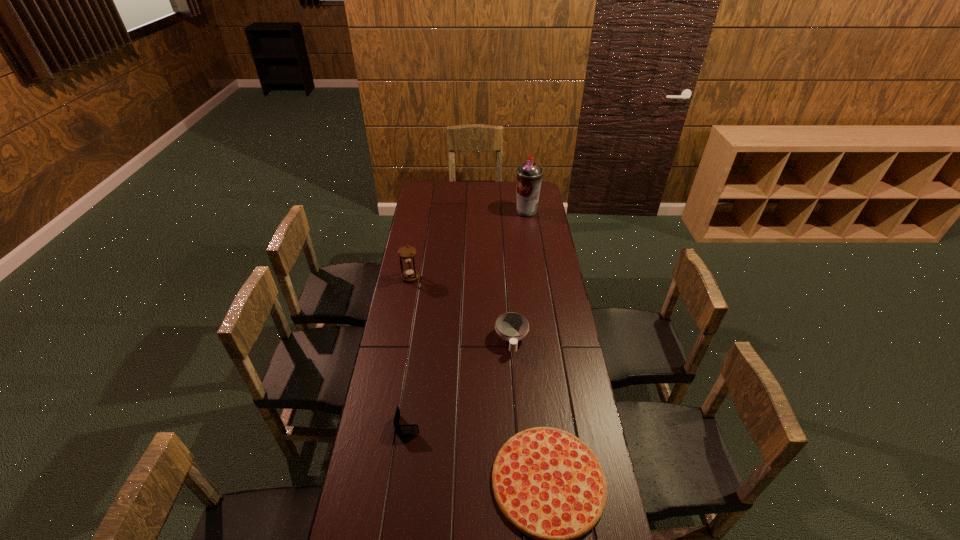
Where is `the farthest object`? Image resolution: width=960 pixels, height=540 pixels. the farthest object is located at coordinates (529, 175).

The image size is (960, 540). Find the location of `aerosol can`. aerosol can is located at coordinates (529, 175).

Identify the location of the leftmost object. The width and height of the screenshot is (960, 540). (408, 253).

I want to click on the fourth shortest object, so click(408, 253).

The image size is (960, 540). What are the coordinates of `chinaware` in the screenshot? It's located at (512, 327).

Where is `the third farthest object`? This screenshot has height=540, width=960. the third farthest object is located at coordinates (512, 327).

At what (x,y) coordinates should I click in order to perform the action: click on wallet. Please return your answer as a coordinate pair (x, y). Looking at the image, I should click on (408, 429).

The height and width of the screenshot is (540, 960). Find the location of `the fourth object from right to left`. the fourth object from right to left is located at coordinates (408, 429).

Locate an element on the screen. free space located on the left of the aerosol can is located at coordinates (450, 212).

The width and height of the screenshot is (960, 540). Find the location of `vacant space located on the front of the hourglass`. vacant space located on the front of the hourglass is located at coordinates (404, 314).